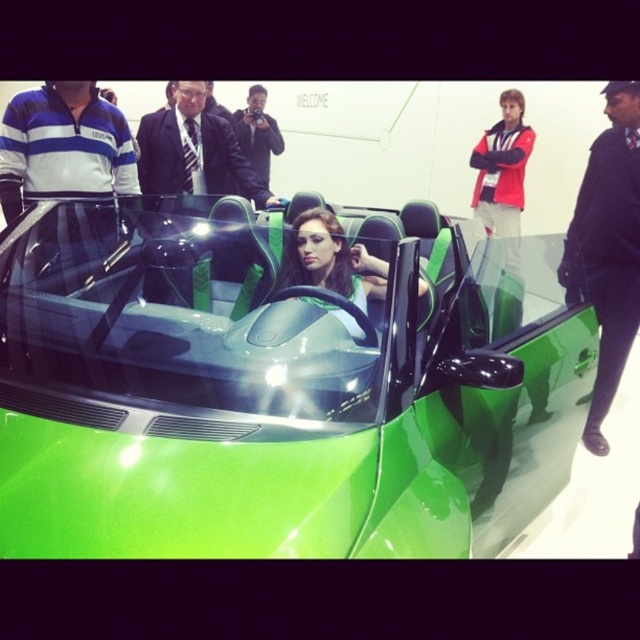
Question: Is matte black suit at center smaller than shiny black suit at center?

Choices:
 (A) yes
 (B) no

Answer: (B)

Question: Does velvet black suit at right have a smaller size compared to shiny black hair at center?

Choices:
 (A) no
 (B) yes

Answer: (A)

Question: Which of these objects is positioned closest to the matte black suit at center?

Choices:
 (A) shiny black suit at center
 (B) shiny black hair at center

Answer: (B)

Question: Which of the following is the closest to the observer?

Choices:
 (A) (64, 106)
 (B) (346, 262)
 (C) (604, 237)

Answer: (B)

Question: Based on their relative distances, which object is farther from the shiny black suit at center?

Choices:
 (A) matte black suit at center
 (B) shiny black hair at center
 (C) blue striped polo shirt at left
 (D) green glossy car at center

Answer: (D)

Question: Does green glossy car at center have a smaller size compared to matte black suit at center?

Choices:
 (A) yes
 (B) no

Answer: (B)